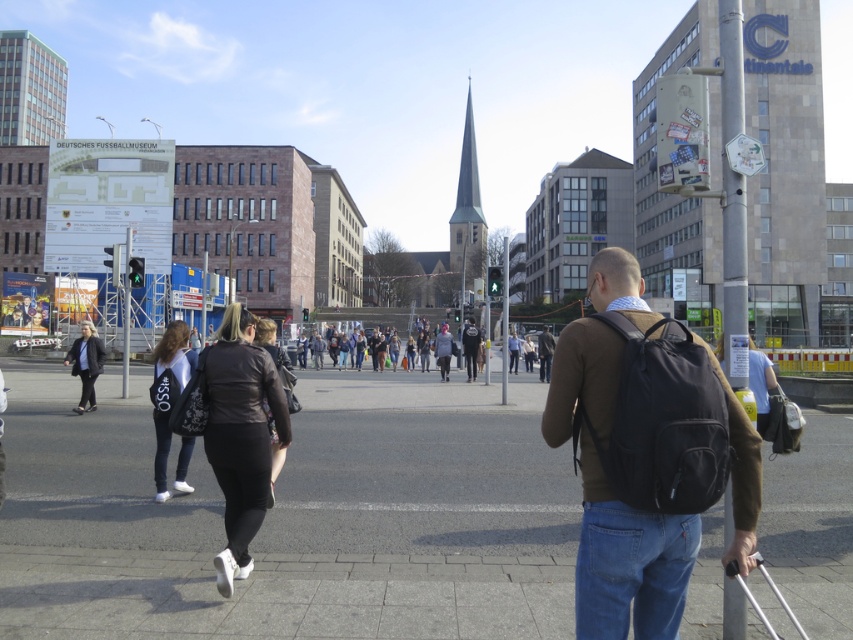
Is point (202, 360) closer to camera compared to point (97, 362)?

Yes, it is.

Is point (239, 404) positioned behind point (84, 388)?

No.

Locate an element on the screen. The width and height of the screenshot is (853, 640). leather jacket at center is located at coordinates (241, 435).

Identify the location of leather jacket at center. (241, 435).

Is point (555, 403) positioned in front of point (463, 339)?

Yes.

Which is more to the right, matte black backpack at right or dark brown leather jacket at center?

dark brown leather jacket at center is more to the right.

This screenshot has width=853, height=640. Identify the location of matte black backpack at right. (619, 560).

Does white leather jacket at lower left appear on the right side of dark gray leather jacket at lower left?

Yes, white leather jacket at lower left is to the right of dark gray leather jacket at lower left.

What do you see at coordinates (173, 353) in the screenshot? I see `white leather jacket at lower left` at bounding box center [173, 353].

Where is `white leather jacket at lower left`? white leather jacket at lower left is located at coordinates (173, 353).